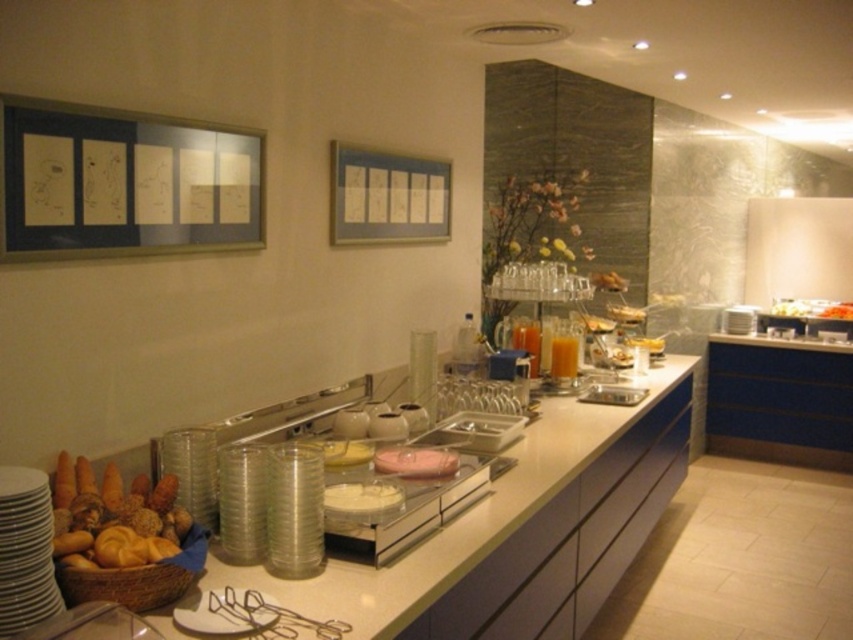
Question: Which object is closer to the camera taking this photo?

Choices:
 (A) translucent glass cup at center
 (B) pink glossy plate at center
 (C) yellow matte bread at center
 (D) orange matte bread at center

Answer: (B)

Question: Which point appears farthest from the camera in this image?

Choices:
 (A) (654, 342)
 (B) (573, 360)
 (C) (840, 312)
 (D) (405, 445)

Answer: (C)

Question: Does golden brown bread at lower left have a greater width compared to translucent glass cup at center?

Choices:
 (A) no
 (B) yes

Answer: (B)

Question: Can you confirm if pink glossy plate at center is positioned to the right of translucent glass cup at center?

Choices:
 (A) yes
 (B) no

Answer: (B)

Question: Observing the image, what is the correct spatial positioning of white glossy counter top at center in reference to orange matte bread at center?

Choices:
 (A) left
 (B) right

Answer: (A)

Question: Which of the following is the farthest from the observer?

Choices:
 (A) yellow matte bread at center
 (B) white glossy counter top at center

Answer: (A)